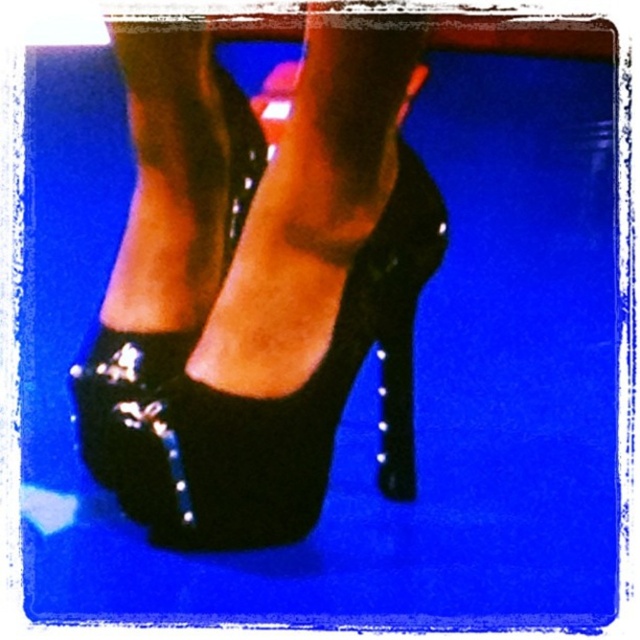
You are a photographer setting up a shoot with a camera focused on a vibrant blue background. You want to place the shiny black high heels at center exactly 30 inches away from the camera lens. Based on the current setup, will the heels be in focus if your camera is set to auto focus at 30 inches?

The shiny black high heels at center are currently 32.59 inches away from the camera, which is 2.59 inches further than the auto focus setting of 30 inches. Therefore, the heels may not be in focus unless the camera adjusts its focus distance.